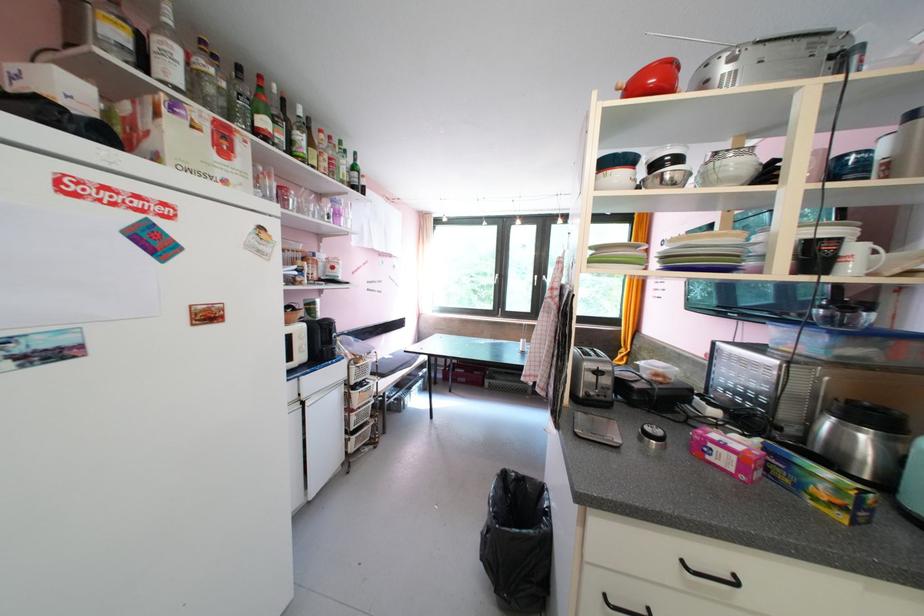
Where is `white mug handle`? Image resolution: width=924 pixels, height=616 pixels. white mug handle is located at coordinates (876, 257).